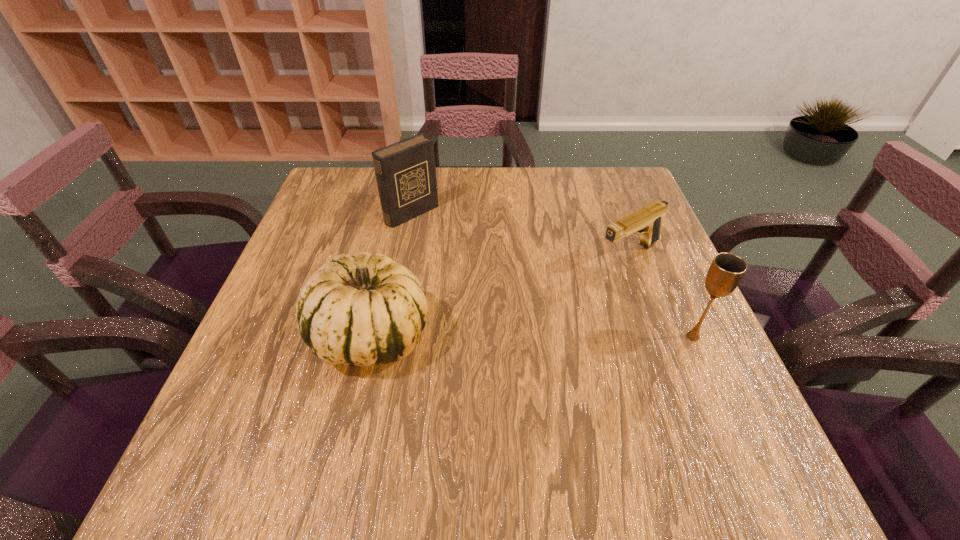
You are a GUI agent. You are given a task and a screenshot of the screen. Output one action in this format:
    pyautogui.click(x=<x>, y=<y>)
    Task: Click on the vacant space at the near edge
    The height and width of the screenshot is (540, 960).
    Given the screenshot: What is the action you would take?
    pyautogui.click(x=405, y=418)

In the image, there is a desktop. In order to click on vacant space at the left edge in this screenshot , I will do click(x=279, y=313).

Find the location of a particular element. The width and height of the screenshot is (960, 540). free point at the right edge is located at coordinates (599, 226).

Find the location of a particular element. The width and height of the screenshot is (960, 540). free region at the far left corner of the desktop is located at coordinates (345, 197).

In the image, there is a desktop. Where is `free space at the far right corner`? Image resolution: width=960 pixels, height=540 pixels. free space at the far right corner is located at coordinates (633, 179).

In order to click on vacant region between the third nearest object and the gourd in this screenshot , I will do 501,295.

Where is `vacant space in between the gourd and the shortest object`? The width and height of the screenshot is (960, 540). vacant space in between the gourd and the shortest object is located at coordinates (501, 295).

Identify the location of vacant area that lies between the diary and the chalice. This screenshot has width=960, height=540. (552, 275).

Identify the location of blank region between the chalice and the diary. This screenshot has height=540, width=960. (552, 275).

At what (x,y) coordinates should I click in order to perform the action: click on free spot between the pistol and the gourd. Please return your answer as a coordinate pair (x, y). The image size is (960, 540). Looking at the image, I should click on 501,295.